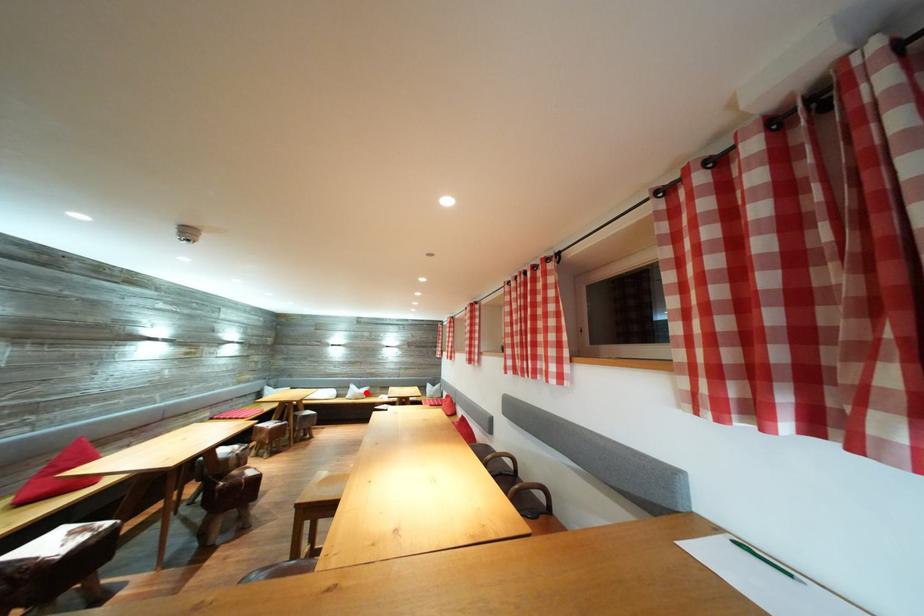
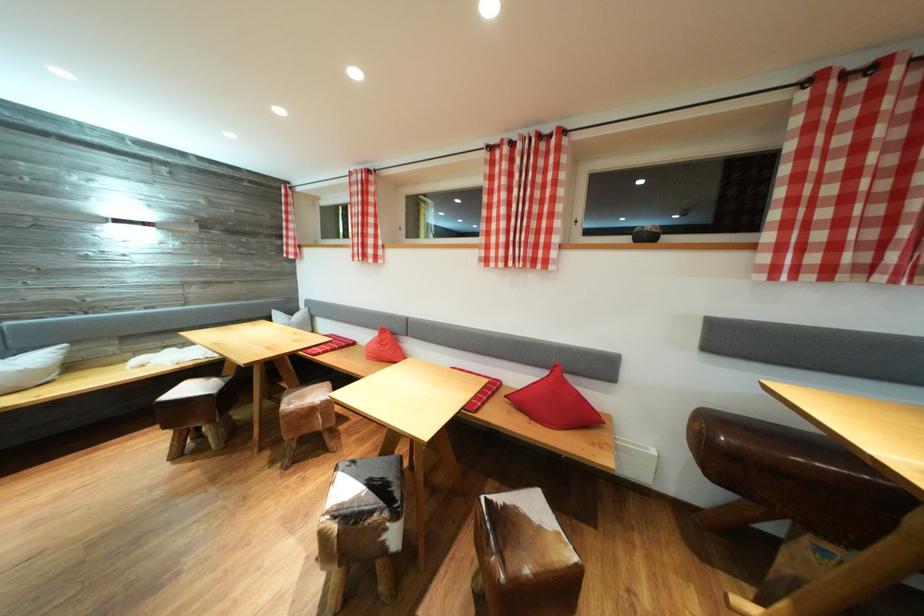
Question: I am providing you with two images of the same scene from different viewpoints. A red point is marked on the first image. Is the red point's position out of view in image 2?

Choices:
 (A) Yes
 (B) No

Answer: (B)